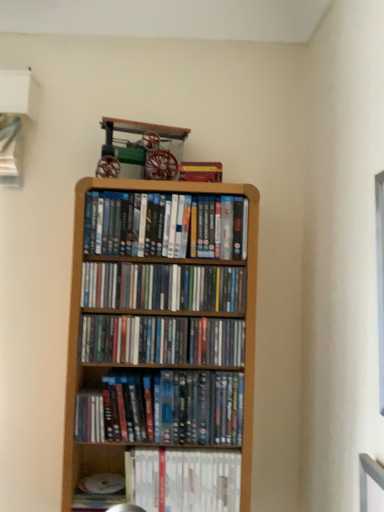
What do you see at coordinates (163, 409) in the screenshot? I see `matte plastic books at center, which is the 2th book from bottom to top` at bounding box center [163, 409].

What do you see at coordinates (184, 480) in the screenshot?
I see `white glossy book at lower center, the 5th book positioned from the top` at bounding box center [184, 480].

From the picture: Measure the distance between wooden shelf at center, the 4th book positioned from the bottom, and camera.

wooden shelf at center, the 4th book positioned from the bottom, is 3.71 feet from camera.

Find the location of a particular element. This screenshot has width=384, height=512. matte plastic books at center, which is the 2th book from bottom to top is located at coordinates (163, 409).

Between wooden bookcase at center and white glossy book at lower center, the 5th book positioned from the top, which one has smaller width?

Thinner between the two is white glossy book at lower center, the 5th book positioned from the top.

Between wooden bookcase at center and white glossy book at lower center, the 5th book positioned from the top, which one has more height?

wooden bookcase at center.

Consider the image. From a real-world perspective, relative to white glossy book at lower center, the 5th book positioned from the top, is wooden bookcase at center vertically above or below?

From a real-world perspective, wooden bookcase at center is physically above white glossy book at lower center, the 5th book positioned from the top.

Considering the relative sizes of wooden bookcase at center and white glossy book at lower center, the first book from the bottom, in the image provided, is wooden bookcase at center smaller than white glossy book at lower center, the first book from the bottom,?

Actually, wooden bookcase at center might be larger than white glossy book at lower center, the first book from the bottom.

Is point (155, 344) less distant than point (182, 409)?

No, (155, 344) is further to viewer.

Can you tell me how much matte plastic dvds at center, which is the third book from bottom to top, and matte plastic books at center, which is the 2th book from bottom to top, differ in facing direction?

There is a 0.00292-degree angle between the facing directions of matte plastic dvds at center, which is the third book from bottom to top, and matte plastic books at center, which is the 2th book from bottom to top.

Is matte plastic dvds at center, which is the third book from bottom to top, far away from matte plastic books at center, which is the 4th book in top-to-bottom order?

matte plastic dvds at center, which is the third book from bottom to top, is near matte plastic books at center, which is the 4th book in top-to-bottom order, not far away.

Looking at this image, is matte plastic dvds at center, which is the third book from bottom to top, turned away from matte plastic books at center, which is the 2th book from bottom to top?

No, matte plastic dvds at center, which is the third book from bottom to top, is not facing the opposite direction of matte plastic books at center, which is the 2th book from bottom to top.

Which of these two, matte plastic dvds at center, which is counted as the 5th book, starting from the bottom, or wooden shelf at center, the 4th book positioned from the bottom, stands taller?

matte plastic dvds at center, which is counted as the 5th book, starting from the bottom, is taller.

Between matte plastic dvds at center, which is counted as the 5th book, starting from the bottom, and wooden shelf at center, the 4th book positioned from the bottom, which one has larger size?

Bigger between the two is matte plastic dvds at center, which is counted as the 5th book, starting from the bottom.

How different are the orientations of matte plastic dvds at center, which is counted as the 5th book, starting from the bottom, and wooden shelf at center, arranged as the second book when viewed from the top, in degrees?

They differ by 0.319 degrees in their facing directions.

Looking at this image, can you confirm if matte plastic dvds at center, which is counted as the 5th book, starting from the bottom, is thinner than wooden shelf at center, the 4th book positioned from the bottom?

No, matte plastic dvds at center, which is counted as the 5th book, starting from the bottom, is not thinner than wooden shelf at center, the 4th book positioned from the bottom.

Looking at this image, could you tell me if wooden shelf at center, the 4th book positioned from the bottom, is turned towards wooden bookcase at center?

Yes, wooden shelf at center, the 4th book positioned from the bottom, is oriented towards wooden bookcase at center.

Does wooden shelf at center, the 4th book positioned from the bottom, contain wooden bookcase at center?

No, wooden shelf at center, the 4th book positioned from the bottom, does not contain wooden bookcase at center.

Is wooden shelf at center, the 4th book positioned from the bottom, touching wooden bookcase at center?

wooden shelf at center, the 4th book positioned from the bottom, and wooden bookcase at center are not in contact.

Is wooden shelf at center, arranged as the second book when viewed from the top, positioned behind wooden bookcase at center?

Yes, it is.

Is matte plastic books at center, which is the 2th book from bottom to top, not close to white glossy book at lower center, the first book from the bottom?

No, matte plastic books at center, which is the 2th book from bottom to top, is not far away from white glossy book at lower center, the first book from the bottom.

Is matte plastic books at center, which is the 2th book from bottom to top, oriented away from white glossy book at lower center, the first book from the bottom?

No.

Is white glossy book at lower center, the first book from the bottom, inside matte plastic books at center, which is the 4th book in top-to-bottom order?

No, matte plastic books at center, which is the 4th book in top-to-bottom order, does not contain white glossy book at lower center, the first book from the bottom.

In the scene shown: Considering the sizes of objects matte plastic books at center, which is the 2th book from bottom to top, and white glossy book at lower center, the first book from the bottom, in the image provided, who is thinner, matte plastic books at center, which is the 2th book from bottom to top, or white glossy book at lower center, the first book from the bottom,?

With smaller width is white glossy book at lower center, the first book from the bottom.

Measure the distance between white glossy book at lower center, the 5th book positioned from the top, and matte plastic dvds at center, which is the third book from bottom to top.

12.05 inches.

From a real-world perspective, who is located lower, white glossy book at lower center, the first book from the bottom, or matte plastic dvds at center, which is the third book from bottom to top?

Result: From a 3D spatial view, white glossy book at lower center, the first book from the bottom, is below.

Consider the image. Would you say white glossy book at lower center, the 5th book positioned from the top, is to the left or to the right of matte plastic dvds at center, which is the third book from bottom to top, in the picture?

From the image, it's evident that white glossy book at lower center, the 5th book positioned from the top, is to the right of matte plastic dvds at center, which is the third book from bottom to top.

From the image's perspective, relative to matte plastic dvds at center, which is the third book from bottom to top, is white glossy book at lower center, the first book from the bottom, above or below?

Clearly, from the image's perspective, white glossy book at lower center, the first book from the bottom, is below matte plastic dvds at center, which is the third book from bottom to top.

From the image's perspective, which is above, wooden bookcase at center or matte plastic dvds at center, which is counted as the 5th book, starting from the bottom?

matte plastic dvds at center, which is counted as the 5th book, starting from the bottom, appears higher in the image.

Does wooden bookcase at center have a greater width compared to matte plastic dvds at center, which is counted as the 5th book, starting from the bottom?

Indeed, wooden bookcase at center has a greater width compared to matte plastic dvds at center, which is counted as the 5th book, starting from the bottom.

Is point (206, 357) less distant than point (129, 219)?

Yes.

Locate an element on the screen. The height and width of the screenshot is (512, 384). bookcase located above the white glossy book at lower center, the 5th book positioned from the top (from the image's perspective) is located at coordinates (159, 327).

From a real-world perspective, which book is the 1st one above the matte plastic books at center, which is the 2th book from bottom to top? Please provide its 2D coordinates.

[(161, 340)]

Based on their spatial positions, is matte plastic dvds at center, which is counted as the 1th book, starting from the top, or matte plastic dvds at center, which is the third book from bottom to top, further from matte plastic books at center, which is the 2th book from bottom to top?

matte plastic dvds at center, which is counted as the 1th book, starting from the top, is positioned further to the anchor matte plastic books at center, which is the 2th book from bottom to top.

Based on their spatial positions, is matte plastic dvds at center, which is the third book from bottom to top, or wooden bookcase at center closer to matte plastic books at center, which is the 2th book from bottom to top?

matte plastic dvds at center, which is the third book from bottom to top, is positioned closer to the anchor matte plastic books at center, which is the 2th book from bottom to top.

From the image, which object appears to be farther from matte plastic dvds at center, which is the third book from bottom to top, matte plastic books at center, which is the 2th book from bottom to top, or matte plastic dvds at center, which is counted as the 1th book, starting from the top?

matte plastic dvds at center, which is counted as the 1th book, starting from the top, lies further to matte plastic dvds at center, which is the third book from bottom to top, than the other object.

Considering their positions, is wooden bookcase at center positioned closer to matte plastic dvds at center, which is the third book from bottom to top, than white glossy book at lower center, the first book from the bottom?

Among the two, wooden bookcase at center is located nearer to matte plastic dvds at center, which is the third book from bottom to top.

When comparing their distances from wooden bookcase at center, does matte plastic books at center, which is the 2th book from bottom to top, or white glossy book at lower center, the 5th book positioned from the top, seem closer?

matte plastic books at center, which is the 2th book from bottom to top, is closer to wooden bookcase at center.

Looking at the image, which one is located further to matte plastic books at center, which is the 4th book in top-to-bottom order, white glossy book at lower center, the first book from the bottom, or wooden bookcase at center?

The object further to matte plastic books at center, which is the 4th book in top-to-bottom order, is wooden bookcase at center.

Considering their positions, is wooden bookcase at center positioned further to matte plastic dvds at center, which is counted as the 1th book, starting from the top, than matte plastic dvds at center, acting as the third book starting from the top?

Among the two, matte plastic dvds at center, acting as the third book starting from the top, is located further to matte plastic dvds at center, which is counted as the 1th book, starting from the top.

When comparing their distances from matte plastic dvds at center, which is counted as the 5th book, starting from the bottom, does matte plastic dvds at center, acting as the third book starting from the top, or matte plastic books at center, which is the 4th book in top-to-bottom order, seem further?

matte plastic books at center, which is the 4th book in top-to-bottom order, is further to matte plastic dvds at center, which is counted as the 5th book, starting from the bottom.

In order to click on book between matte plastic dvds at center, which is counted as the 5th book, starting from the bottom, and matte plastic dvds at center, acting as the third book starting from the top, in the up-down direction in this screenshot , I will do `click(164, 287)`.

At what (x,y) coordinates should I click in order to perform the action: click on bookcase between wooden shelf at center, the 4th book positioned from the bottom, and matte plastic books at center, which is the 4th book in top-to-bottom order, from top to bottom. Please return your answer as a coordinate pair (x, y). The image size is (384, 512). Looking at the image, I should click on (159, 327).

You are a GUI agent. You are given a task and a screenshot of the screen. Output one action in this format:
    pyautogui.click(x=<x>, y=<y>)
    Task: Click on the bookcase between matte plastic dvds at center, which is counted as the 1th book, starting from the top, and white glossy book at lower center, the 5th book positioned from the top, vertically
    This screenshot has width=384, height=512.
    Given the screenshot: What is the action you would take?
    pyautogui.click(x=159, y=327)

Locate an element on the screen. bookcase that lies between matte plastic dvds at center, acting as the third book starting from the top, and white glossy book at lower center, the 5th book positioned from the top, from top to bottom is located at coordinates (159, 327).